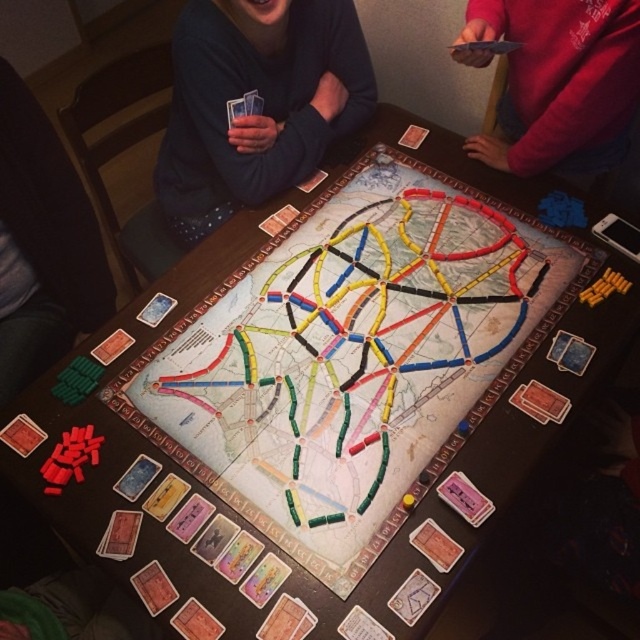
Question: Does dark blue sweater at upper center have a greater width compared to red sweater at upper right?

Choices:
 (A) yes
 (B) no

Answer: (A)

Question: Which point appears closest to the camera in this image?

Choices:
 (A) (192, 115)
 (B) (502, 6)

Answer: (A)

Question: Which of the following is the farthest from the observer?

Choices:
 (A) (496, 36)
 (B) (289, 90)

Answer: (B)

Question: Is dark blue sweater at upper center to the left of red sweater at upper right from the viewer's perspective?

Choices:
 (A) yes
 (B) no

Answer: (A)

Question: From the image, what is the correct spatial relationship of dark blue sweater at upper center in relation to red sweater at upper right?

Choices:
 (A) below
 (B) above

Answer: (A)

Question: Which point appears closest to the camera in this image?

Choices:
 (A) (269, 19)
 (B) (572, 104)

Answer: (B)